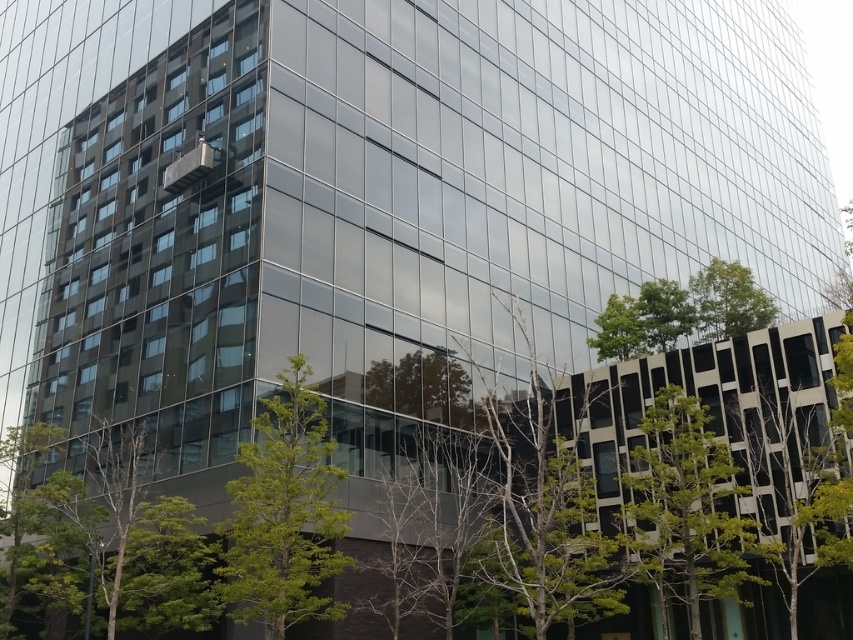
You are standing in front of the modern building and want to determine which tree has a thicker trunk between the green leafy tree at center and the green leafy tree at lower right. Which one should you choose?

The green leafy tree at lower right has a thicker trunk than the green leafy tree at center, so you should choose the green leafy tree at lower right.

You are standing at the entrance of the modern building and want to take a photo of the green leafy tree at center. Based on its position, where should you aim your camera to capture it in the frame?

The green leafy tree at center is located at coordinates point (283,513), so aim your camera slightly to the right and upper middle section of the building to capture it in the frame.

You are standing in front of the modern building and see the green leafy tree at center and the green leafy tree at lower right. Which tree would cast a shorter shadow during midday when the sun is directly overhead?

The green leafy tree at center is smaller than the green leafy tree at lower right, so it would cast a shorter shadow during midday when the sun is directly overhead.